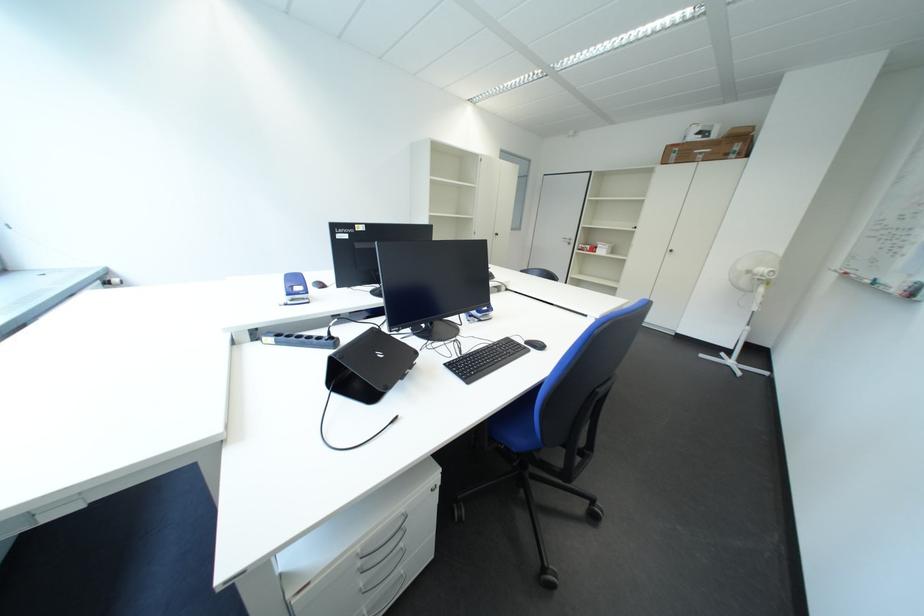
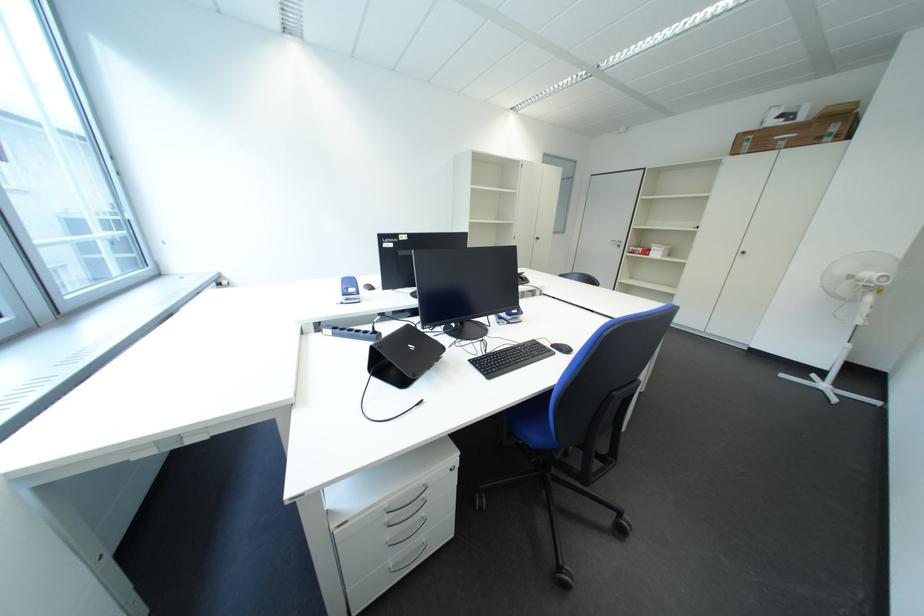
Question: The camera is either moving clockwise (left) or counter-clockwise (right) around the object. The first image is from the beginning of the video and the second image is from the end. Is the camera moving left or right when shooting the video?

Choices:
 (A) Left
 (B) Right

Answer: (B)